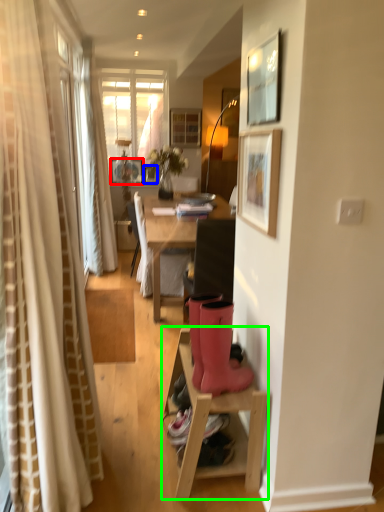
Question: Estimate the real-world distances between objects in this image. Which object is farther from picture frame (highlighted by a red box), picture frame (highlighted by a blue box) or table (highlighted by a green box)?

Choices:
 (A) picture frame
 (B) table

Answer: (B)